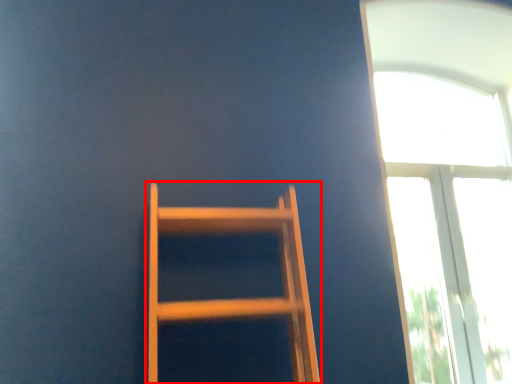
Question: Considering the relative positions of furniture (annotated by the red box) and window in the image provided, where is furniture (annotated by the red box) located with respect to the staircase?

Choices:
 (A) left
 (B) right

Answer: (A)